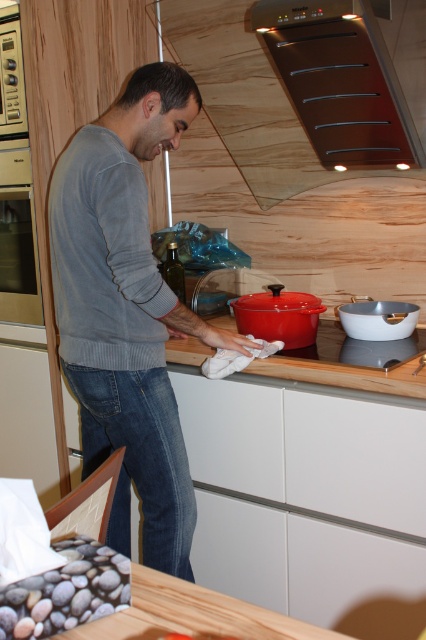
Question: Considering the real-world distances, which object is farthest from the wooden cutting board at center?

Choices:
 (A) brushed metal exhaust hood at upper center
 (B) matte stainless steel oven at left

Answer: (B)

Question: Which point is farther to the camera?

Choices:
 (A) (383, 353)
 (B) (106, 118)

Answer: (A)

Question: Does gray sweater at center appear on the right side of matte stainless steel oven at left?

Choices:
 (A) no
 (B) yes

Answer: (B)

Question: Does gray sweater at center appear on the left side of brushed metal exhaust hood at upper center?

Choices:
 (A) yes
 (B) no

Answer: (A)

Question: Can you confirm if brushed metal exhaust hood at upper center is positioned above matte stainless steel oven at left?

Choices:
 (A) yes
 (B) no

Answer: (A)

Question: Among these points, which one is nearest to the camera?

Choices:
 (A) (267, 209)
 (B) (382, 388)
 (C) (5, 138)

Answer: (B)